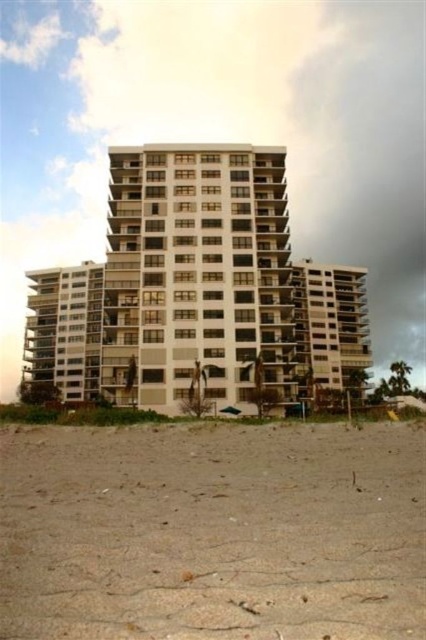
Question: Can you confirm if brown sandy beach at lower center is positioned above white smooth building at center?

Choices:
 (A) yes
 (B) no

Answer: (B)

Question: Can you confirm if brown sandy beach at lower center is smaller than white smooth building at center?

Choices:
 (A) yes
 (B) no

Answer: (A)

Question: Does brown sandy beach at lower center appear on the right side of white smooth building at center?

Choices:
 (A) yes
 (B) no

Answer: (B)

Question: Which of the following is the closest to the observer?

Choices:
 (A) brown sandy beach at lower center
 (B) white smooth building at center

Answer: (A)